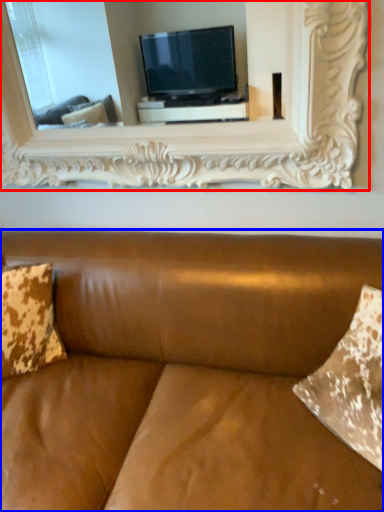
Question: Which point is closer to the camera, picture frame (highlighted by a red box) or studio couch (highlighted by a blue box)?

Choices:
 (A) picture frame
 (B) studio couch

Answer: (B)